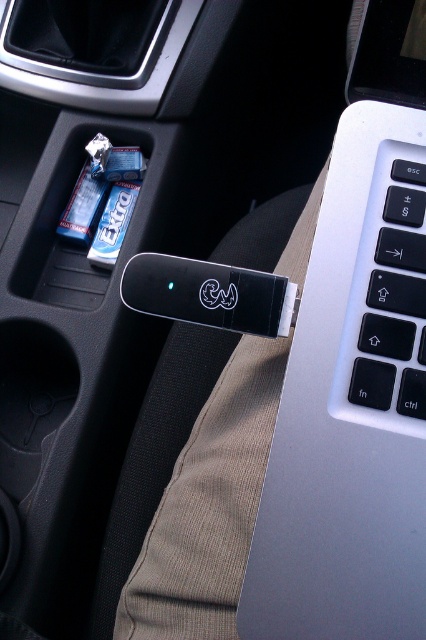
Question: Observing the image, what is the correct spatial positioning of silver metallic laptop at center-right in reference to white plastic keyboard at upper right?

Choices:
 (A) right
 (B) left

Answer: (A)

Question: Is silver metallic laptop at center-right below white plastic keyboard at upper right?

Choices:
 (A) yes
 (B) no

Answer: (A)

Question: Which point is closer to the camera?

Choices:
 (A) white plastic keyboard at upper right
 (B) silver metallic laptop at center-right

Answer: (B)

Question: Does silver metallic laptop at center-right come behind white plastic keyboard at upper right?

Choices:
 (A) no
 (B) yes

Answer: (A)